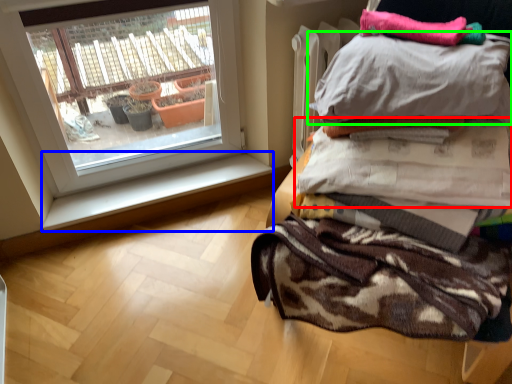
Question: Considering the real-world distances, which object is farthest from blanket (highlighted by a red box)? window sill (highlighted by a blue box) or pillow (highlighted by a green box)?

Choices:
 (A) window sill
 (B) pillow

Answer: (A)